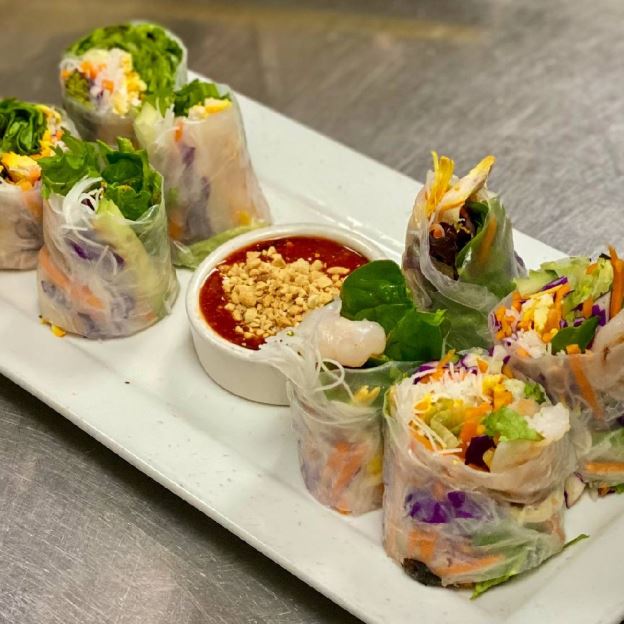
This screenshot has height=624, width=624. In order to click on platter is diagonal from lower right to upper left in this screenshot , I will do `click(180, 399)`.